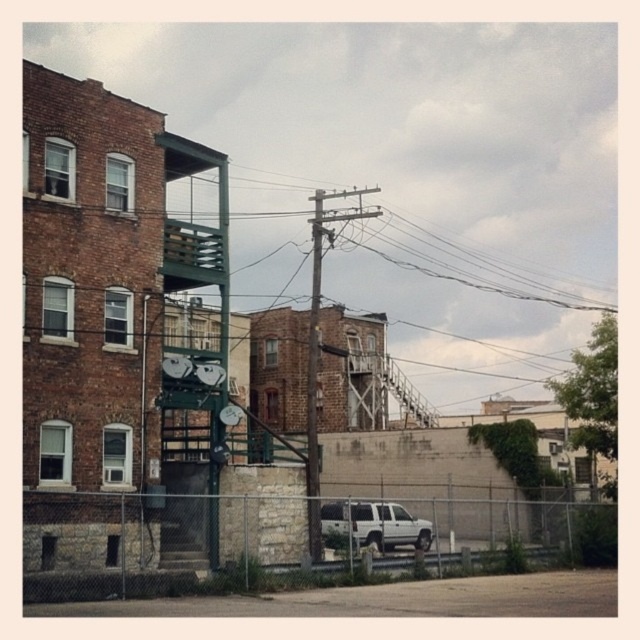
Does gray chain-link fence at lower center lie in front of smooth wooden utility pole at center?

Yes, it is in front of smooth wooden utility pole at center.

Is gray chain-link fence at lower center to the right of smooth wooden utility pole at center from the viewer's perspective?

Correct, you'll find gray chain-link fence at lower center to the right of smooth wooden utility pole at center.

The width and height of the screenshot is (640, 640). I want to click on gray chain-link fence at lower center, so click(148, 541).

At what (x,y) coordinates should I click in order to perform the action: click on gray chain-link fence at lower center. Please return your answer as a coordinate pair (x, y). Looking at the image, I should click on (148, 541).

Who is shorter, white matte suv at lower center or smooth wooden utility pole at center?

With less height is white matte suv at lower center.

Is white matte suv at lower center thinner than smooth wooden utility pole at center?

In fact, white matte suv at lower center might be wider than smooth wooden utility pole at center.

Describe the element at coordinates (372, 525) in the screenshot. I see `white matte suv at lower center` at that location.

In order to click on white matte suv at lower center in this screenshot , I will do `click(372, 525)`.

Does gray chain-link fence at lower center have a smaller size compared to white matte suv at lower center?

Incorrect, gray chain-link fence at lower center is not smaller in size than white matte suv at lower center.

From the picture: Can you confirm if gray chain-link fence at lower center is positioned to the right of white matte suv at lower center?

In fact, gray chain-link fence at lower center is to the left of white matte suv at lower center.

Locate an element on the screen. The height and width of the screenshot is (640, 640). gray chain-link fence at lower center is located at coordinates (148, 541).